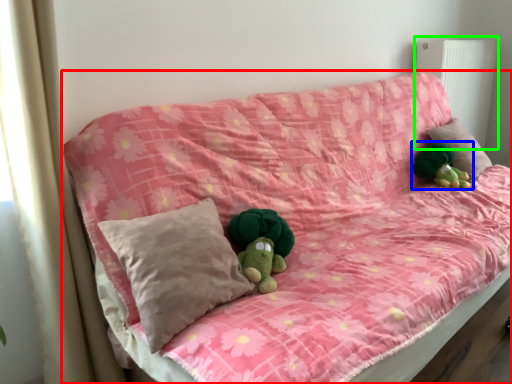
Question: Estimate the real-world distances between objects in this image. Which object is closer to furniture (highlighted by a red box), toy (highlighted by a blue box) or radiator (highlighted by a green box)?

Choices:
 (A) toy
 (B) radiator

Answer: (A)